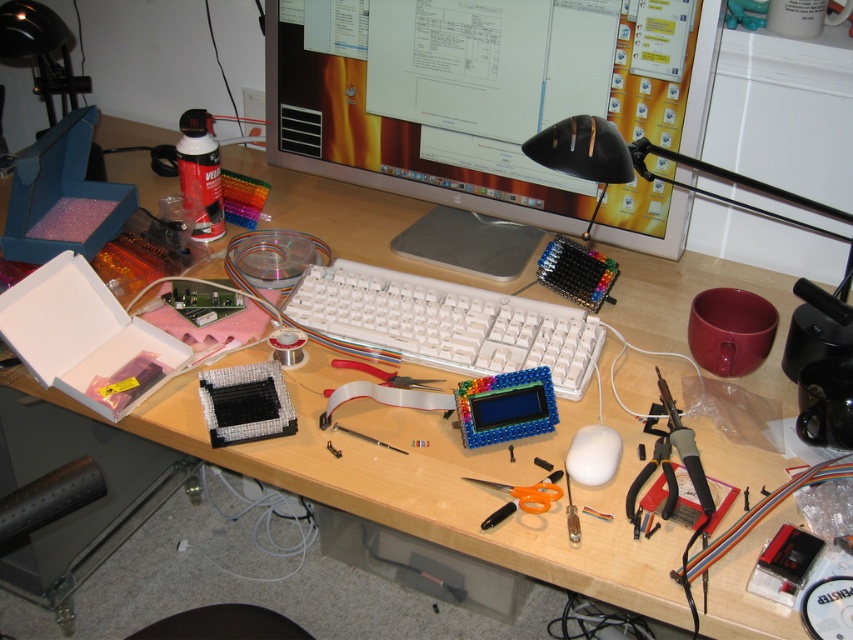
Consider the image. You need to place both the white plastic keyboard at center and the metallic silver pliers at lower right into a storage box. If the box can only fit items smaller than the keyboard, will the pliers fit?

The white plastic keyboard at center is bigger than the metallic silver pliers at lower right, so the pliers are smaller and will fit into the box.

You are a delivery person who needs to place a 1.2 meter long package on the desk without moving any existing items. The package must be placed in the direction of the longest side of the white plastic keyboard at center. Is there enough space on the desk for the package?

The white plastic keyboard at center is 1.01 meters from the camera, but the package is 1.2 meters long. Since the package is longer than the distance from the keyboard to the edge of the desk, it won